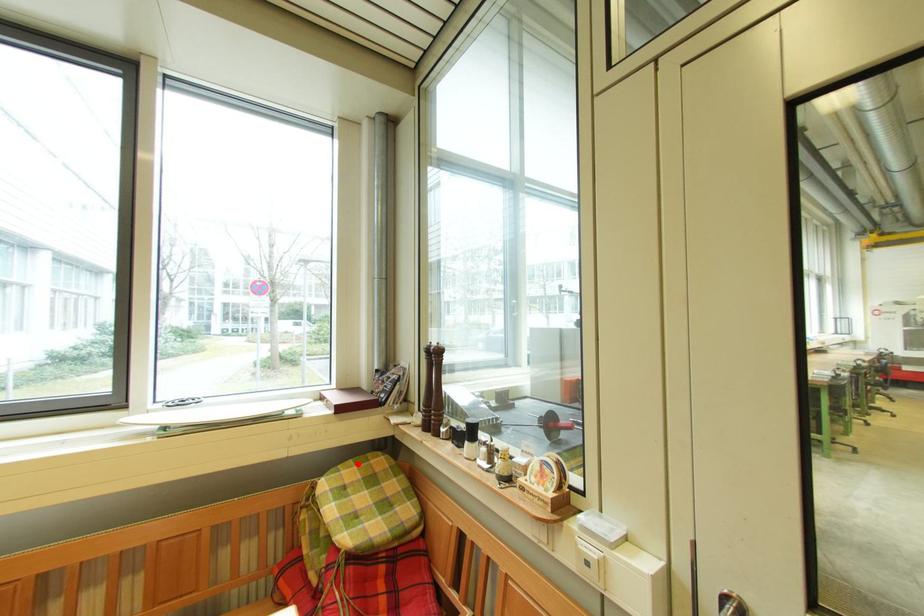
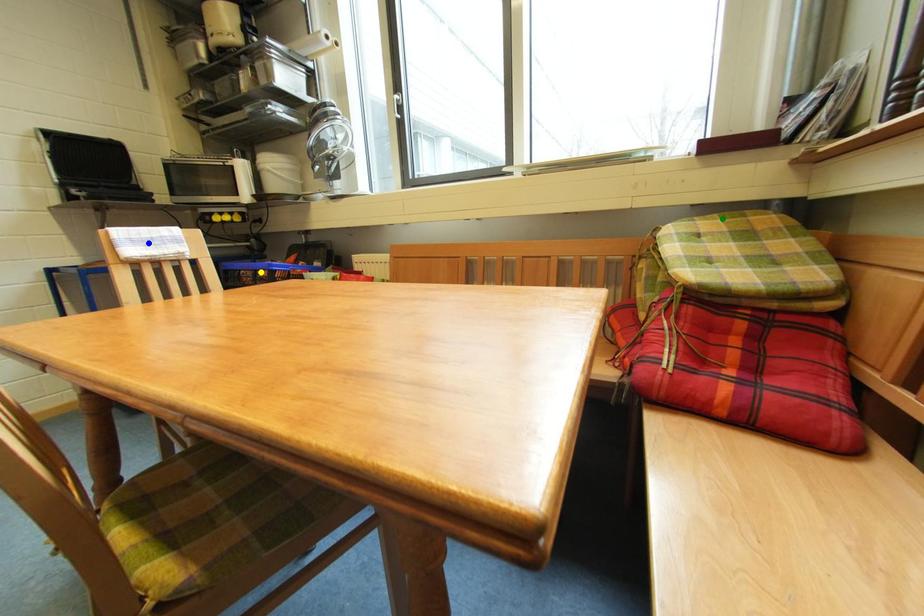
Question: I am providing you with two images of the same scene from different viewpoints. A red point is marked on the first image. You are given multiple points on the second image. Can you choose the point in image 2 that corresponds to the point in image 1?

Choices:
 (A) green point
 (B) yellow point
 (C) blue point

Answer: (A)